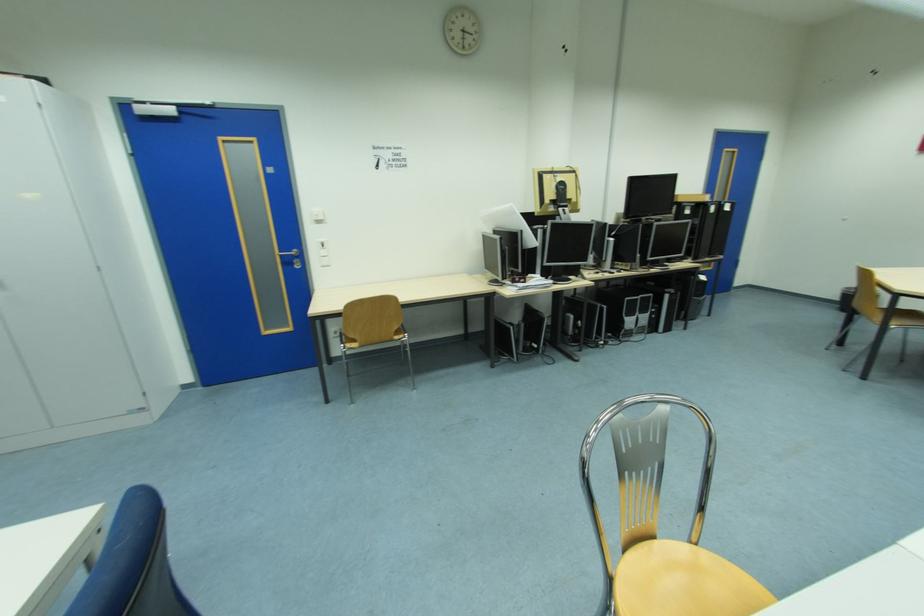
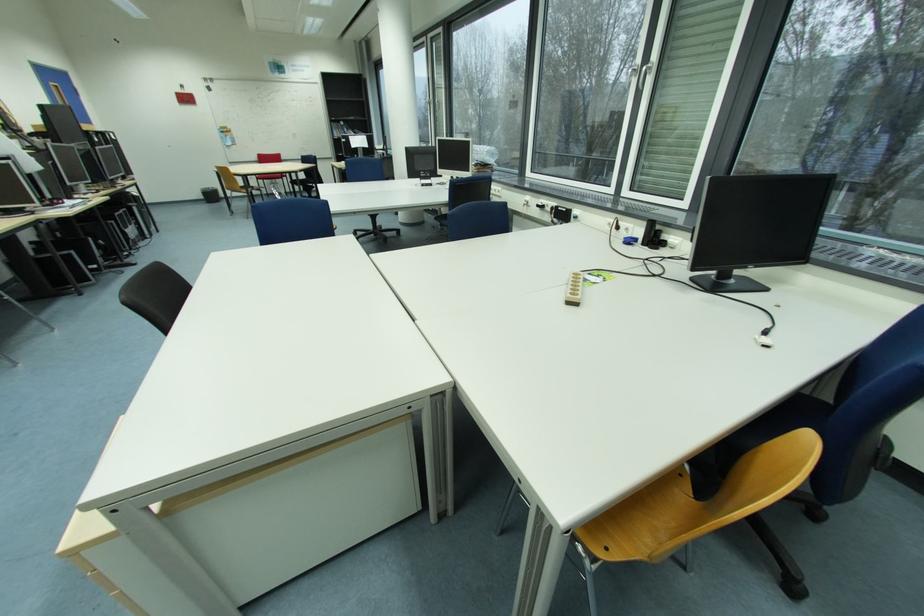
Where in the second image is the point corresponding to point (845, 300) from the first image?

(209, 198)